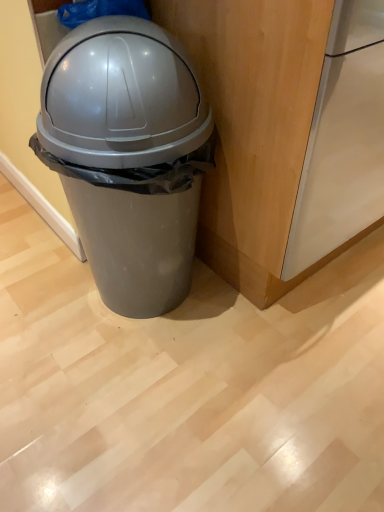
This screenshot has width=384, height=512. I want to click on free location in front of matte gray plastic trash can at center, so click(136, 403).